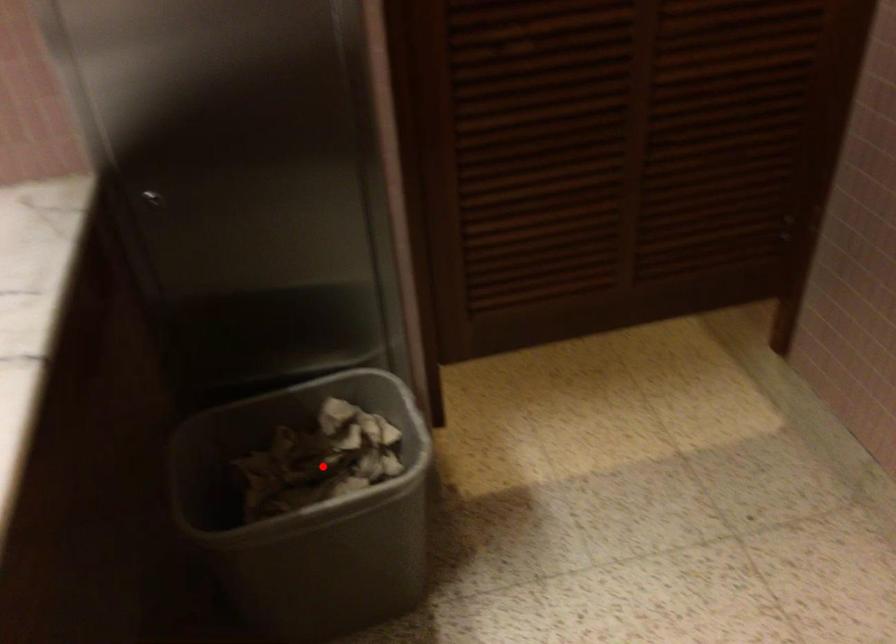
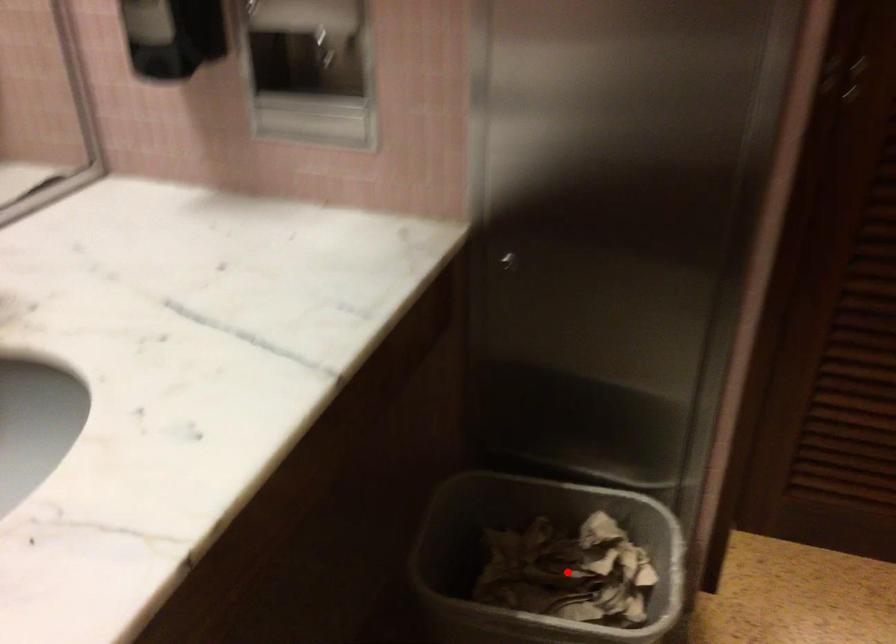
I am providing you with two images of the same scene from different viewpoints. A red point is marked on the first image and another point is marked on the second image. Is the red point in image1 aligned with the point shown in image2?

Yes